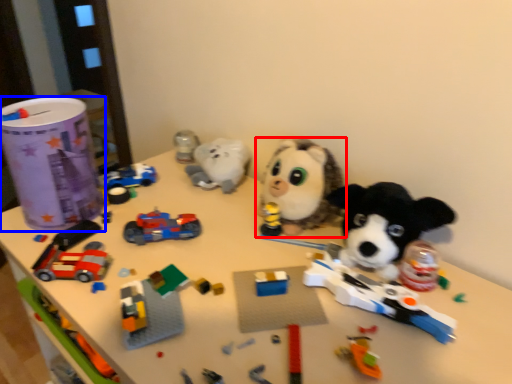
Question: Which object is further to the camera taking this photo, toy (highlighted by a red box) or toy (highlighted by a blue box)?

Choices:
 (A) toy
 (B) toy

Answer: (B)